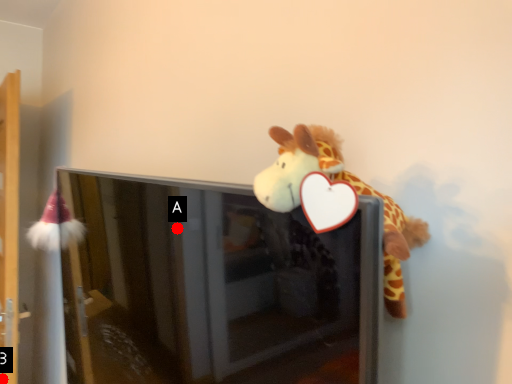
Question: Two points are circled on the image, labeled by A and B beside each circle. Among these points, which one is nearest to the camera?

Choices:
 (A) A is closer
 (B) B is closer

Answer: (A)